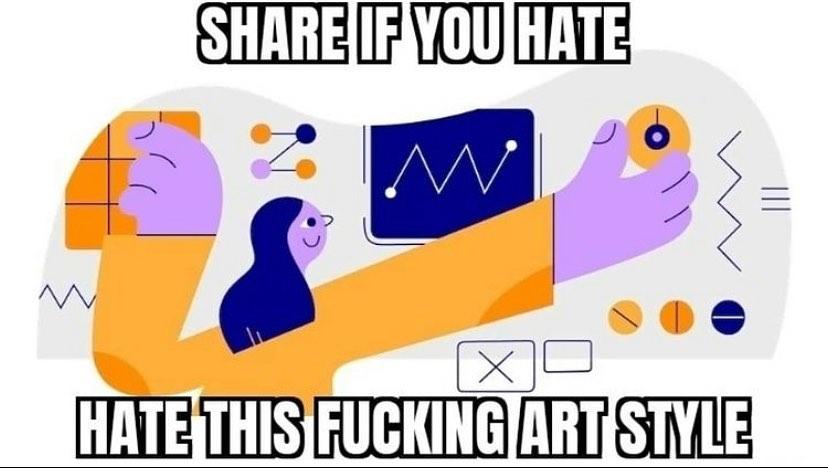
Locate an element on the screen. The height and width of the screenshot is (468, 828). yellow knob is located at coordinates (686, 144).